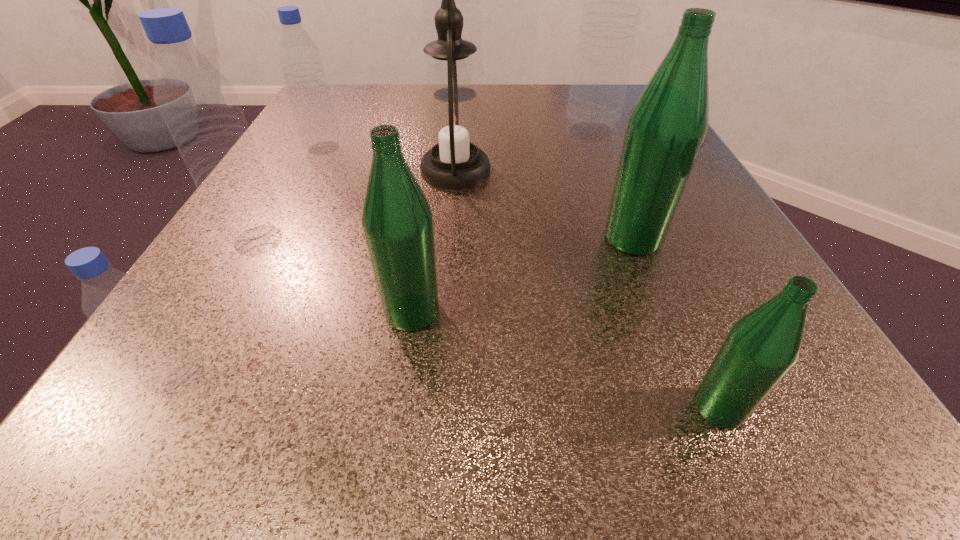
You are a GUI agent. You are given a task and a screenshot of the screen. Output one action in this format:
    pyautogui.click(x=<x>, y=<y>)
    Task: Click on the blank space that satisfies the following two spatial constraints: 1. on the front side of the farthest object; 2. on the left side of the smallest green bottle
    The width and height of the screenshot is (960, 540).
    Given the screenshot: What is the action you would take?
    pyautogui.click(x=423, y=407)

Identify the location of free space that satisfies the following two spatial constraints: 1. on the front side of the third nearest object; 2. on the right side of the smallest green bottle. The height and width of the screenshot is (540, 960). (397, 407).

Locate an element on the screen. The height and width of the screenshot is (540, 960). vacant area in the image that satisfies the following two spatial constraints: 1. on the back side of the second nearest green bottle; 2. on the left side of the oil lamp is located at coordinates (433, 171).